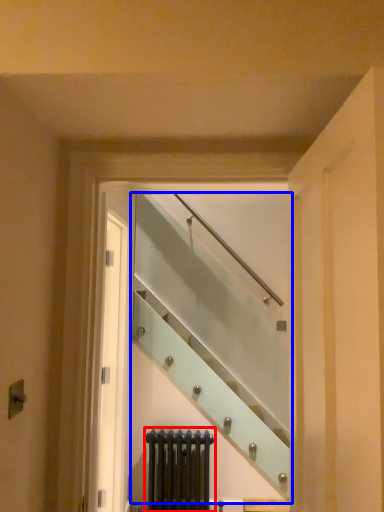
Question: Which of the following is the farthest to the observer, radiator (highlighted by a red box) or escalator (highlighted by a blue box)?

Choices:
 (A) radiator
 (B) escalator

Answer: (A)